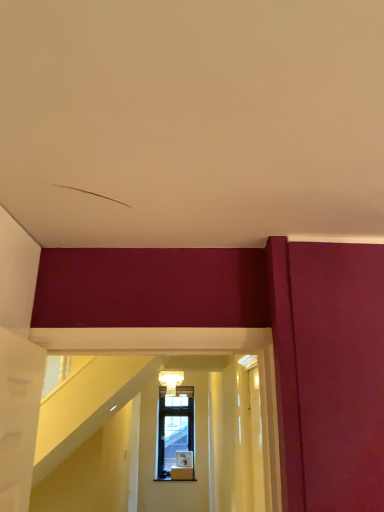
Question: Considering the positions of transparent glass door at right and matte white light fixture at center in the image, is transparent glass door at right wider or thinner than matte white light fixture at center?

Choices:
 (A) thin
 (B) wide

Answer: (A)

Question: From a real-world perspective, is transparent glass door at right physically located above or below matte white light fixture at center?

Choices:
 (A) below
 (B) above

Answer: (A)

Question: Is transparent glass door at right inside or outside of matte white light fixture at center?

Choices:
 (A) inside
 (B) outside

Answer: (B)

Question: From a real-world perspective, is matte white light fixture at center positioned above or below transparent glass door at right?

Choices:
 (A) below
 (B) above

Answer: (B)

Question: Is matte white light fixture at center bigger or smaller than transparent glass door at right?

Choices:
 (A) big
 (B) small

Answer: (B)

Question: Looking at their shapes, would you say matte white light fixture at center is wider or thinner than transparent glass door at right?

Choices:
 (A) thin
 (B) wide

Answer: (B)

Question: Is matte white light fixture at center taller or shorter than transparent glass door at right?

Choices:
 (A) short
 (B) tall

Answer: (A)